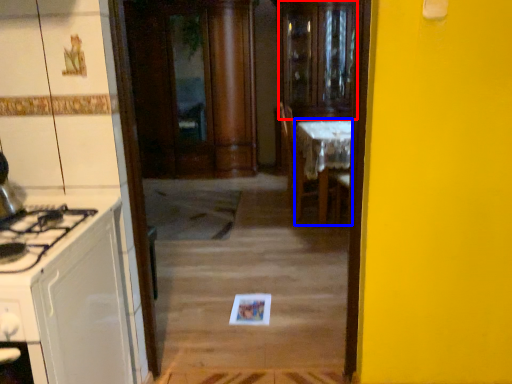
Question: Which of the following is the farthest to the observer, glass door (highlighted by a red box) or table (highlighted by a blue box)?

Choices:
 (A) glass door
 (B) table

Answer: (A)